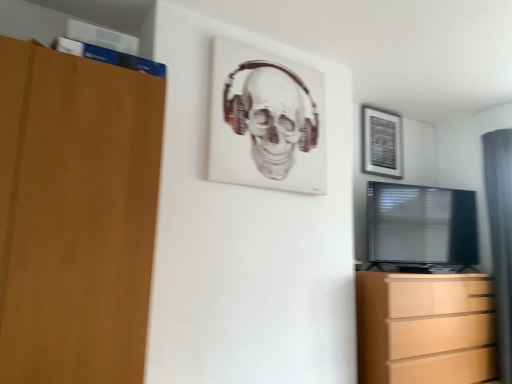
Question: Is matte black picture frame at upper right, the first picture frame viewed from the back, inside the boundaries of white matte picture frame at upper center, which is the 2th picture frame from back to front, or outside?

Choices:
 (A) inside
 (B) outside

Answer: (B)

Question: Is matte black picture frame at upper right, the first picture frame viewed from the back, wider or thinner than white matte picture frame at upper center, the first picture frame positioned from the front?

Choices:
 (A) wide
 (B) thin

Answer: (B)

Question: Which is nearer to the white matte picture frame at upper center, which ranks as the 2th picture frame in right-to-left order?

Choices:
 (A) black glossy tv at right
 (B) gray fabric curtain at right
 (C) matte black picture frame at upper right, placed as the 1th picture frame when sorted from right to left
 (D) light brown wooden chest of drawers at lower right

Answer: (A)

Question: Based on their relative distances, which object is farther from the black glossy tv at right?

Choices:
 (A) light brown wooden chest of drawers at lower right
 (B) white matte picture frame at upper center, which ranks as the 2th picture frame in right-to-left order
 (C) gray fabric curtain at right
 (D) matte black picture frame at upper right, arranged as the second picture frame when viewed from the front

Answer: (B)